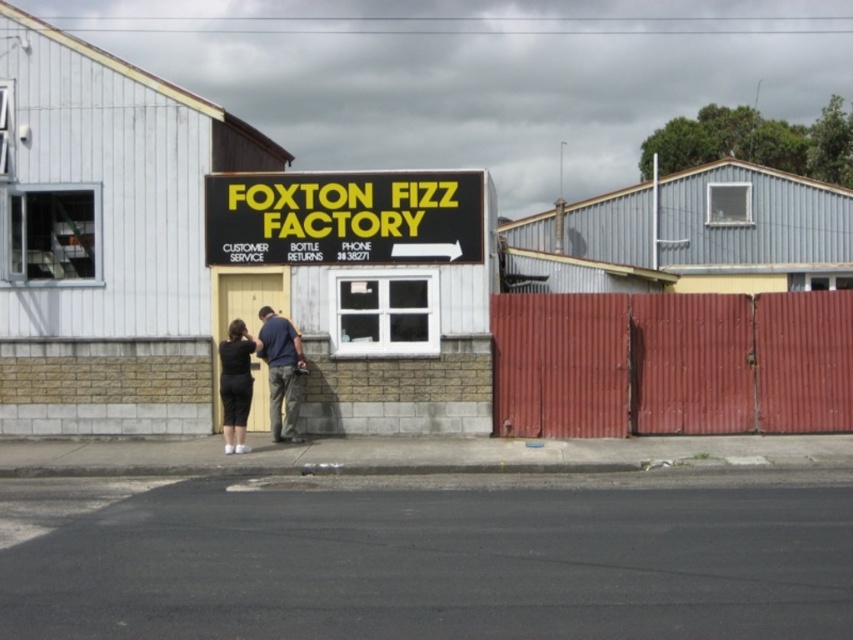
You are a photographer trying to capture the FOXTON FIZZ FACTORY sign clearly. You notice two items in the frame that might distract viewers. The dark blue shirt at center and the black matte dress at lower center. Which of these items should you adjust your camera angle to minimize in the photo, considering their size in the frame?

The dark blue shirt at center is bigger than the black matte dress at lower center, so you should adjust your camera angle to minimize the dark blue shirt at center since it is larger and more distracting.

You are a customer at the Foxton Fizz Factory. You see a person wearing a dark blue shirt at center and a black matte dress at lower center. Which clothing item is wider?

The dark blue shirt at center is wider than the black matte dress at lower center.

You are standing in front of the FOXTON FIZZ FACTORY building. There is a point at coordinates (x=343, y=218). Where exactly is this point located?

The point at coordinates (x=343, y=218) is on the black plastic sign at center.